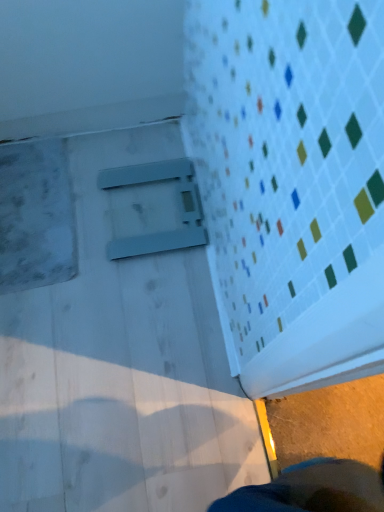
The height and width of the screenshot is (512, 384). In order to click on matte plastic window at center in this screenshot , I will do `click(178, 203)`.

The height and width of the screenshot is (512, 384). What do you see at coordinates (178, 203) in the screenshot?
I see `matte plastic window at center` at bounding box center [178, 203].

This screenshot has height=512, width=384. What are the coordinates of `matte plastic window at center` in the screenshot? It's located at tap(178, 203).